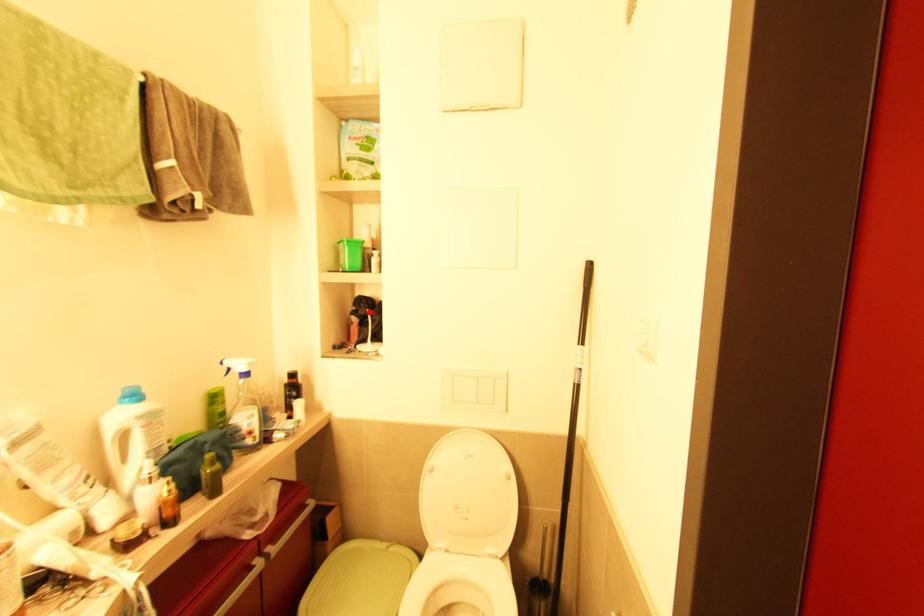
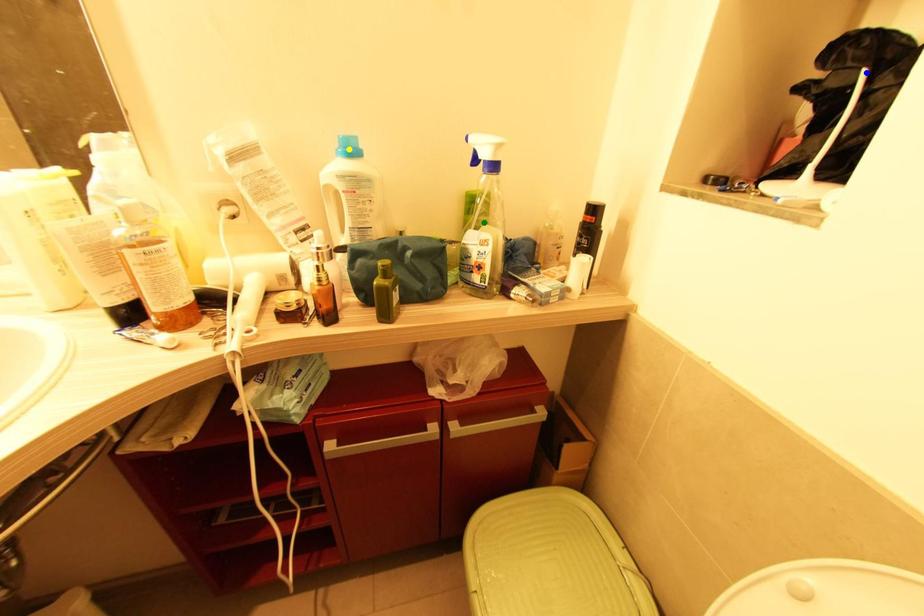
Question: I am providing you with two images of the same scene from different viewpoints. A red point is marked on the first image. You are given multiple points on the second image. Which mark in image 2 goes with the point in image 1?

Choices:
 (A) yellow point
 (B) blue point
 (C) green point

Answer: (B)